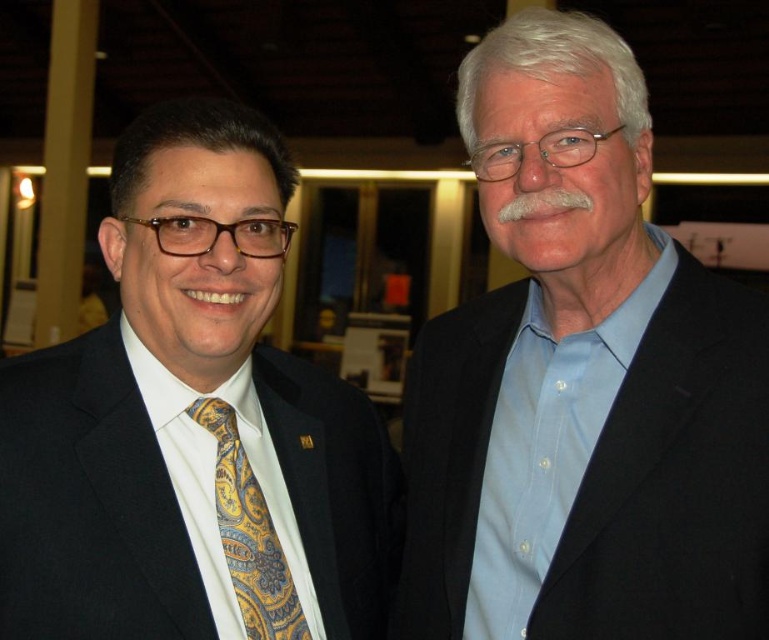
You are a photographer adjusting the lighting for a portrait. You need to ensure that the blue cotton shirt at right and the matte black suit at left are both visible in the frame. Which object should you focus on to ensure proper exposure, and why?

The blue cotton shirt at right should be focused on because it is positioned over the matte black suit at left, meaning it is closer to the camera and thus requires proper exposure adjustment to capture details accurately.

You are a photographer setting up a camera to capture a group photo of two people. You notice the blue cotton shirt at right and the matte black suit at left in the frame. Which clothing item appears wider in the photo?

→ The blue cotton shirt at right appears wider in the photo because its width is larger than that of the matte black suit at left.

You are at a formal event and need to locate the matte black suit at left and the yellow paisley silk tie at left. Based on their positions, which one is positioned to the left side?

The matte black suit at left is positioned to the left of the yellow paisley silk tie at left, so the matte black suit at left is more to the left side.